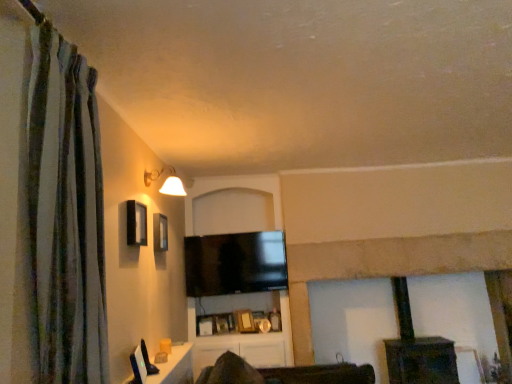
Question: Is white glossy table at lower left in front of or behind matte black window at upper left in the image?

Choices:
 (A) behind
 (B) front

Answer: (B)

Question: From the image's perspective, is white glossy table at lower left above or below matte black window at upper left?

Choices:
 (A) below
 (B) above

Answer: (A)

Question: Which object is the farthest from the matte black window at upper left?

Choices:
 (A) white glossy table at lower left
 (B) dark brown wood fireplace at center
 (C) green striped curtain at left
 (D) flat screen tv at center
 (E) matte white lampshade at upper left

Answer: (B)

Question: Which of these objects is positioned farthest from the dark brown wood fireplace at center?

Choices:
 (A) flat screen tv at center
 (B) matte black window at upper left
 (C) matte white lampshade at upper left
 (D) white glossy table at lower left
 (E) green striped curtain at left

Answer: (E)